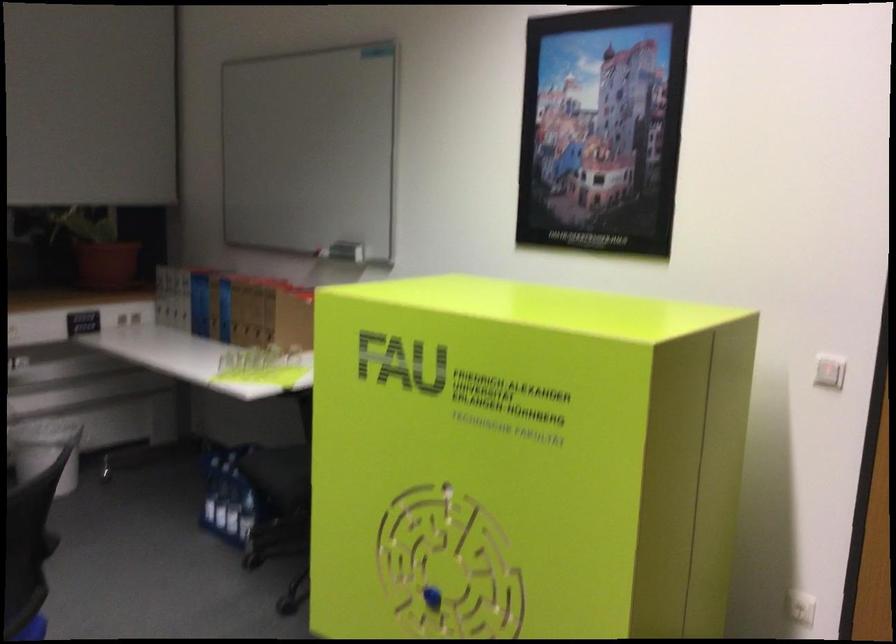
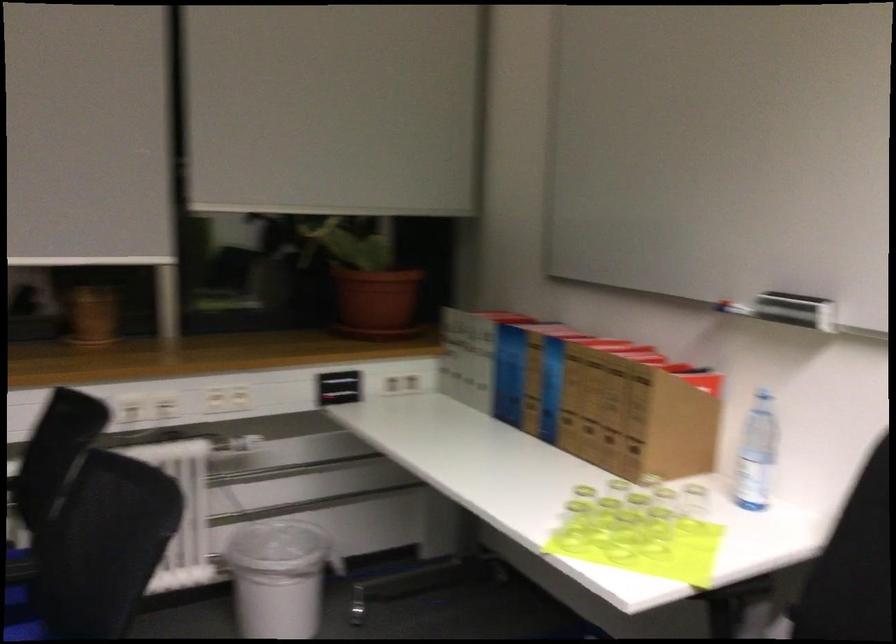
The images are taken continuously from a first-person perspective. In which direction are you moving?

The movement direction of the cameraman is left, forward.